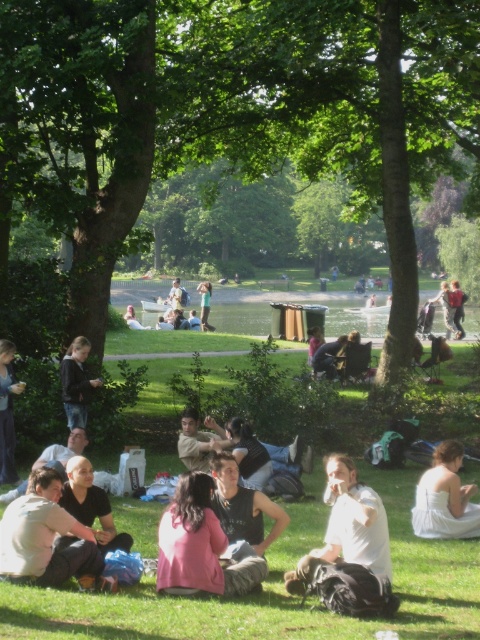
You are a photographer setting up a shoot in the park. You need to choose between two outfits for the session. The outfits are the white satin dress at lower right and the dark blue jeans at lower left. Based on their sizes, which outfit would be more suitable for a full body shot to ensure the subject is clearly visible in the frame?

The white satin dress at lower right has a larger size compared to the dark blue jeans at lower left, so it would be more suitable for a full body shot as it would make the subject more visible in the frame.

You are a photographer trying to capture a shot of the light brown leather jacket at center without including the matte black jacket at lower left. Based on their positions, is this possible?

The matte black jacket at lower left is to the left of the light brown leather jacket at center, so by positioning the camera to the right side of the light brown leather jacket at center, you can exclude the matte black jacket at lower left from the frame.